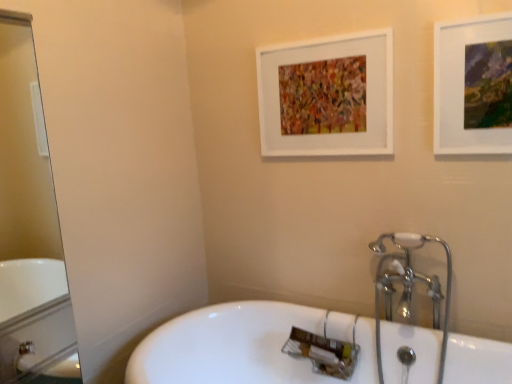
Question: Is white glossy bathtub at center touching clear glass mirror at left?

Choices:
 (A) no
 (B) yes

Answer: (A)

Question: From a real-world perspective, is white glossy bathtub at center beneath clear glass mirror at left?

Choices:
 (A) yes
 (B) no

Answer: (A)

Question: From the image's perspective, is white glossy bathtub at center above clear glass mirror at left?

Choices:
 (A) no
 (B) yes

Answer: (A)

Question: Does white glossy bathtub at center have a smaller size compared to clear glass mirror at left?

Choices:
 (A) yes
 (B) no

Answer: (B)

Question: Does white glossy bathtub at center have a greater height compared to clear glass mirror at left?

Choices:
 (A) no
 (B) yes

Answer: (A)

Question: Is chrome metallic faucet at right in front of or behind matte white picture frame at upper right, which appears as the second picture frame when viewed from the back, in the image?

Choices:
 (A) behind
 (B) front

Answer: (A)

Question: Is chrome metallic faucet at right situated inside matte white picture frame at upper right, the 1th picture frame from the right, or outside?

Choices:
 (A) outside
 (B) inside

Answer: (A)

Question: Is point (396, 236) closer or farther from the camera than point (476, 110)?

Choices:
 (A) farther
 (B) closer

Answer: (A)

Question: Based on their sizes in the image, would you say chrome metallic faucet at right is bigger or smaller than matte white picture frame at upper right, the 1th picture frame from the right?

Choices:
 (A) small
 (B) big

Answer: (B)

Question: Choose the correct answer: Is clear glass mirror at left inside white glossy bathtub at center or outside it?

Choices:
 (A) outside
 (B) inside

Answer: (A)

Question: From the image's perspective, relative to white glossy bathtub at center, is clear glass mirror at left above or below?

Choices:
 (A) below
 (B) above

Answer: (B)

Question: From a real-world perspective, relative to white glossy bathtub at center, is clear glass mirror at left vertically above or below?

Choices:
 (A) below
 (B) above

Answer: (B)

Question: Considering the positions of clear glass mirror at left and white glossy bathtub at center in the image, is clear glass mirror at left wider or thinner than white glossy bathtub at center?

Choices:
 (A) wide
 (B) thin

Answer: (B)

Question: Is white matte picture frame at upper center, placed as the 1th picture frame when sorted from left to right, bigger or smaller than white glossy bathtub at center?

Choices:
 (A) small
 (B) big

Answer: (A)

Question: Based on their positions, is white matte picture frame at upper center, which is the 2th picture frame from front to back, located to the left or right of white glossy bathtub at center?

Choices:
 (A) right
 (B) left

Answer: (A)